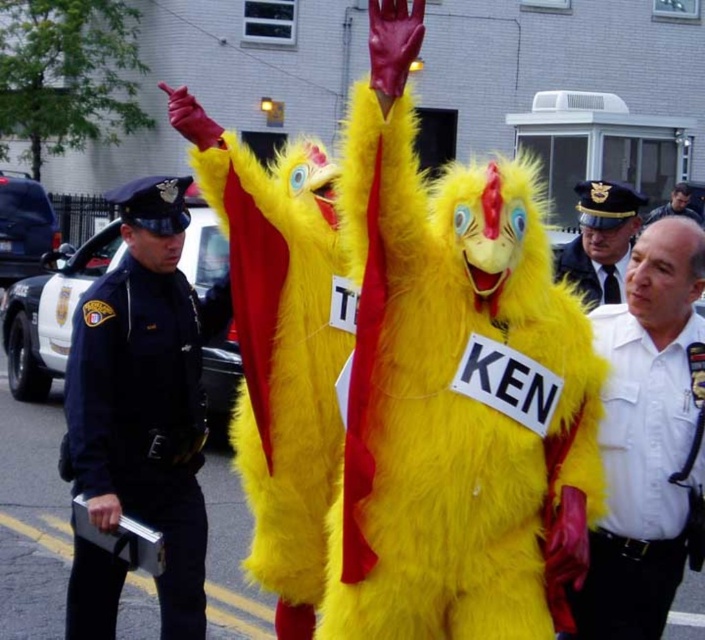
Question: From the image, what is the correct spatial relationship of navy blue uniform at left in relation to smooth black hair at center?

Choices:
 (A) below
 (B) above

Answer: (A)

Question: Does white uniform at center have a lesser width compared to smooth black hair at center?

Choices:
 (A) no
 (B) yes

Answer: (B)

Question: Which of the following is the farthest from the observer?

Choices:
 (A) (140, 234)
 (B) (687, 211)

Answer: (B)

Question: Among these points, which one is farthest from the camera?

Choices:
 (A) (618, 352)
 (B) (123, 468)

Answer: (B)

Question: Considering the real-world distances, which object is closest to the white uniform at center?

Choices:
 (A) navy blue uniform at left
 (B) white uniform shirt at center
 (C) smooth black hair at center

Answer: (B)

Question: Is navy blue uniform at left to the right of white uniform shirt at center from the viewer's perspective?

Choices:
 (A) no
 (B) yes

Answer: (A)